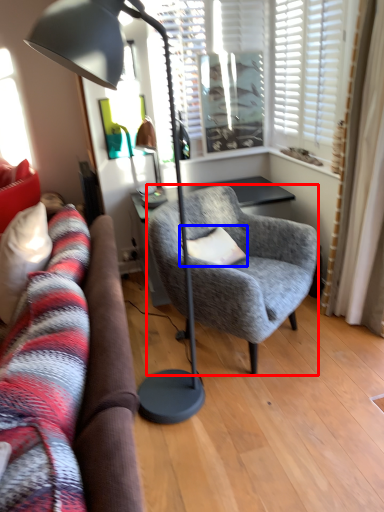
Question: Which object appears closest to the camera in this image, chair (highlighted by a red box) or pillow (highlighted by a blue box)?

Choices:
 (A) chair
 (B) pillow

Answer: (A)